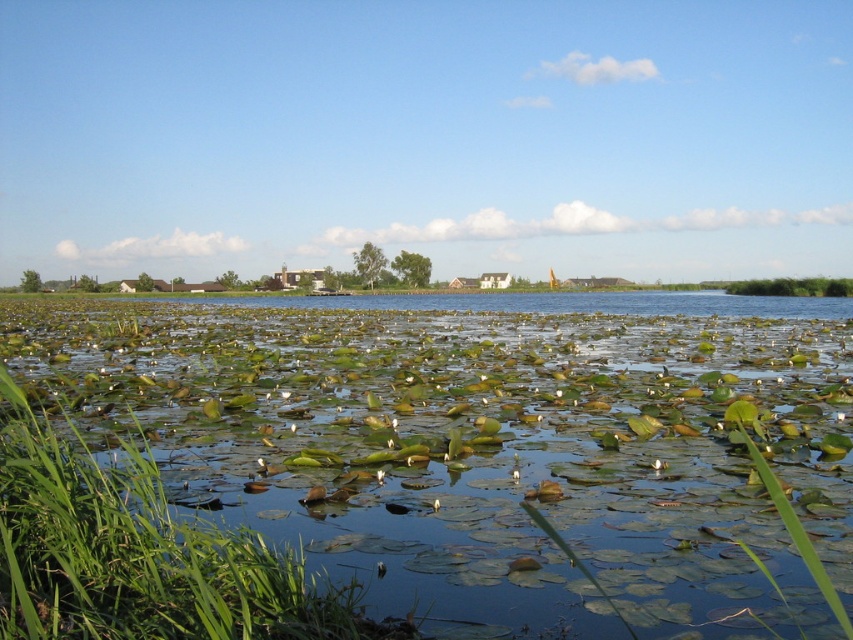
You are standing at the center of the image and want to walk towards the green leafy pond at center. In which direction should you move relative to your current position?

The green leafy pond at center is already at your current position, so you don not need to move in any direction.

You are an environmental scientist examining the lakeside ecosystem. You observe the green leafy pond at center and the green leafy vegetation at right. Which area would you prioritize for sampling if you need to collect a larger quantity of plant samples efficiently?

The green leafy pond at center should be prioritized for sampling since it is bigger than the green leafy vegetation at right, allowing for a larger quantity of plant samples to be collected efficiently.

You are a small frog wanting to jump from the green leafy vegetation at right to the green leafy pond at center. Based on their sizes, which one do you think has a larger surface area to land on?

The green leafy pond at center might be wider than green leafy vegetation at right, so it likely has a larger surface area for the frog to land on.